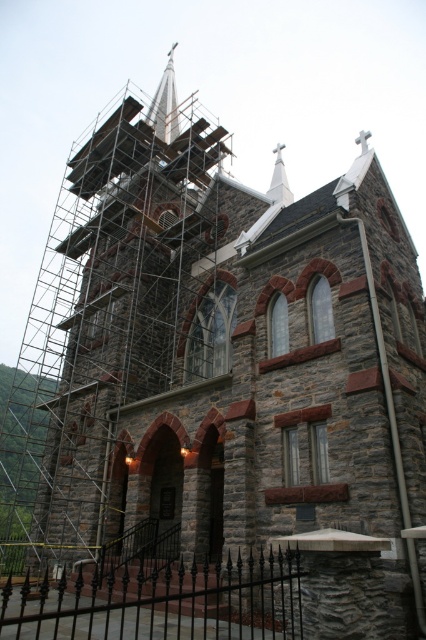
Question: Can you confirm if silver metallic spire at upper center is smaller than white smooth steeple at upper center?

Choices:
 (A) yes
 (B) no

Answer: (B)

Question: From the image, what is the correct spatial relationship of silver metallic spire at upper center in relation to white smooth steeple at upper center?

Choices:
 (A) below
 (B) above

Answer: (B)

Question: In this image, where is silver metallic spire at upper center located relative to white smooth steeple at upper center?

Choices:
 (A) left
 (B) right

Answer: (A)

Question: Which point is farther from the camera taking this photo?

Choices:
 (A) (172, 97)
 (B) (281, 193)

Answer: (A)